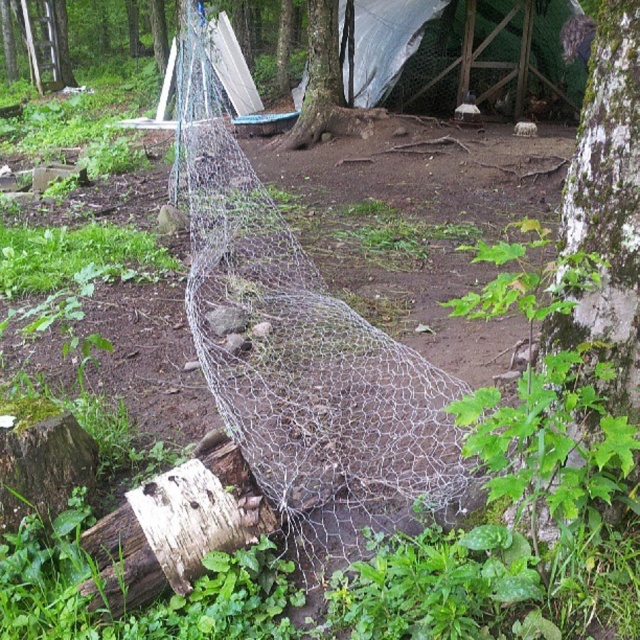
You are standing in the garden and want to place a 2 meter long ladder between the white textured bark at center right and the fence. Is there enough space?

The distance between the white textured bark at center right and the viewer is 1.85 meters. Since the ladder is 2 meters long, it might not fit if placed in that direction. Consider placing it elsewhere or checking the exact positioning.

You are a gardener trying to determine if there is enough space between the wire mesh net at center and the smooth bark tree at center to place a new garden tool shed. Based on the scene description, can you confirm if there is sufficient space?

The wire mesh net at center occupies less space than the smooth bark tree at center, so there is enough space between them to place a new garden tool shed.

Consider the image. You are a gardener trying to assess the layout of the garden. You notice the wire mesh net at center and the white textured bark at center right. Which object is closer to you, the observer?

The wire mesh net at center is closer to you because the white textured bark at center right is behind it.